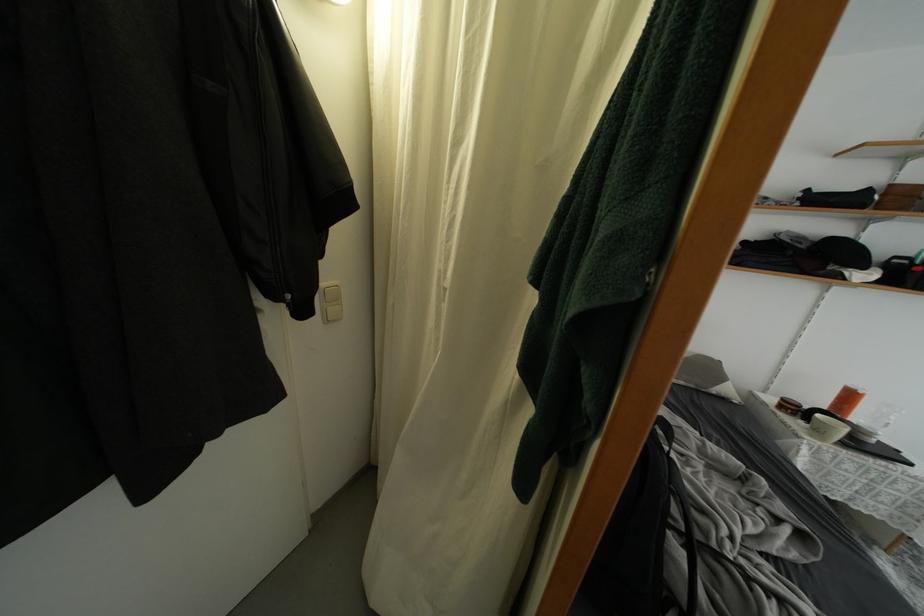
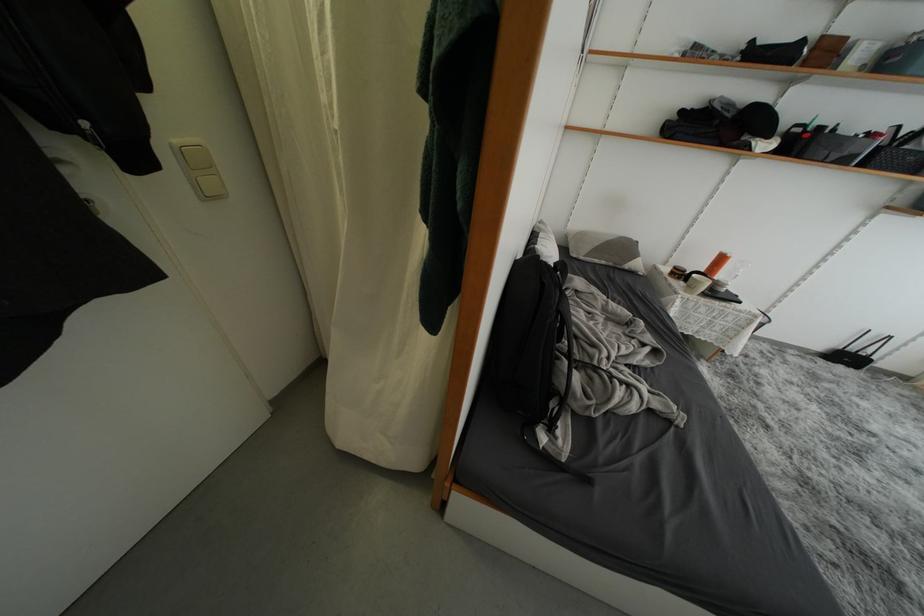
Question: Based on the continuous images, in which direction is the camera rotating? Reply with the corresponding letter.

Choices:
 (A) Left
 (B) Right
 (C) Up
 (D) Down

Answer: (D)